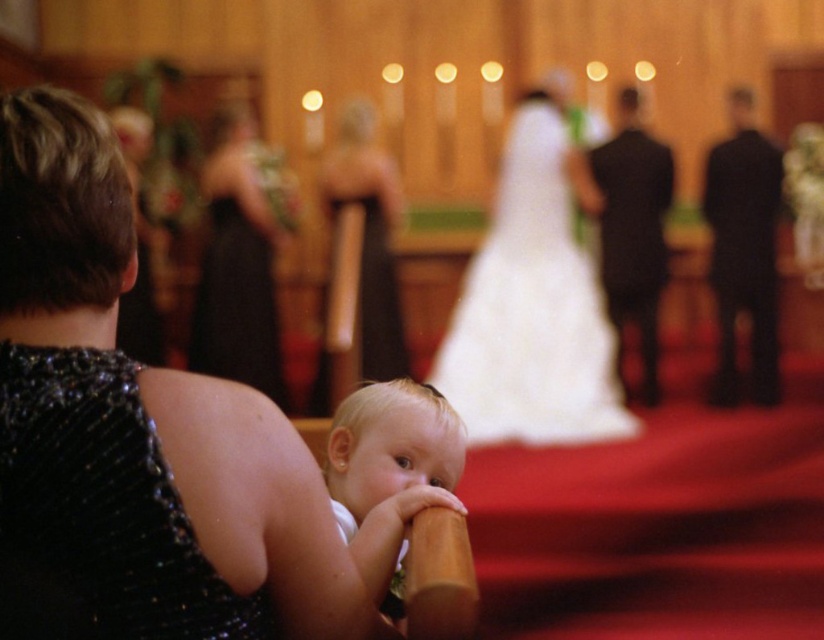
Question: Can you confirm if black sequined dress at lower left is wider than black satin dress at upper left?

Choices:
 (A) no
 (B) yes

Answer: (A)

Question: Which point is closer to the camera?

Choices:
 (A) (200, 481)
 (B) (353, 458)

Answer: (A)

Question: Does sparkly black dress at lower left appear over black sequined dress at lower left?

Choices:
 (A) no
 (B) yes

Answer: (B)

Question: Among these points, which one is nearest to the camera?

Choices:
 (A) (73, 365)
 (B) (387, 579)
 (C) (151, 566)
 (D) (391, 202)

Answer: (C)

Question: From the image, what is the correct spatial relationship of sparkly black dress at lower left in relation to black satin dress at upper left?

Choices:
 (A) right
 (B) left

Answer: (A)

Question: Which point is farther to the camera?

Choices:
 (A) (382, 509)
 (B) (213, 636)
 (C) (265, 268)
 (D) (392, 282)

Answer: (D)